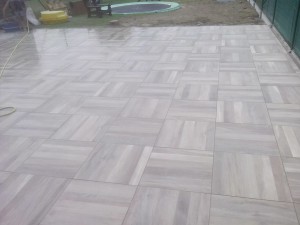
I want to click on floor, so click(190, 125).